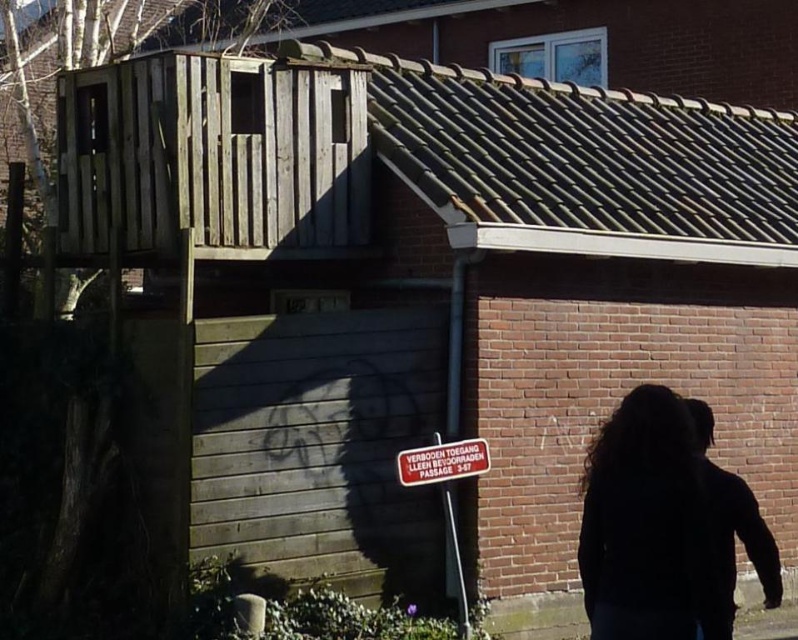
Question: Can you confirm if black matte hair at lower right is positioned below metallic reflective sign at center?

Choices:
 (A) no
 (B) yes

Answer: (A)

Question: Which object appears closest to the camera in this image?

Choices:
 (A) metallic reflective sign at center
 (B) black matte hair at lower right

Answer: (B)

Question: Can you confirm if black matte hair at lower right is wider than metallic reflective sign at center?

Choices:
 (A) no
 (B) yes

Answer: (A)

Question: Is black matte hair at lower right further to camera compared to metallic reflective sign at center?

Choices:
 (A) yes
 (B) no

Answer: (B)